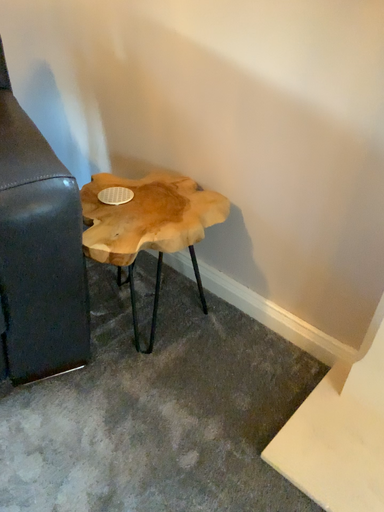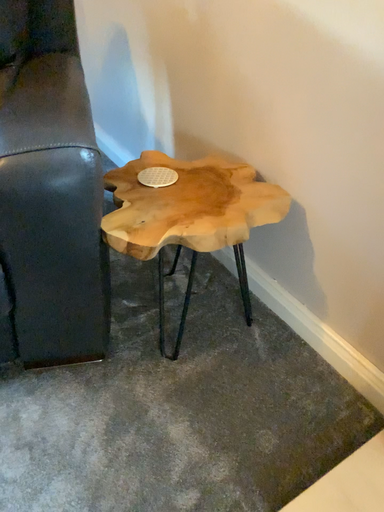
Question: Which way did the camera rotate in the video?

Choices:
 (A) rotated right
 (B) rotated left

Answer: (B)